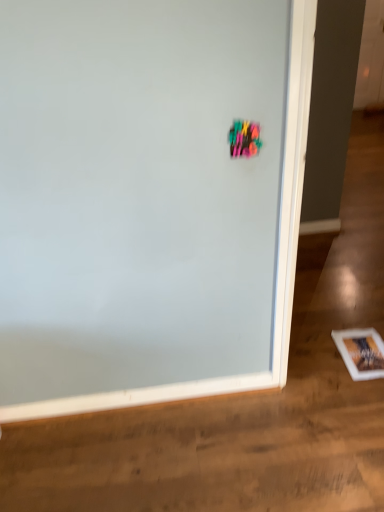
Where is `free space above white matte picture frame at lower right (from a real-world perspective)`? This screenshot has width=384, height=512. free space above white matte picture frame at lower right (from a real-world perspective) is located at coordinates (359, 354).